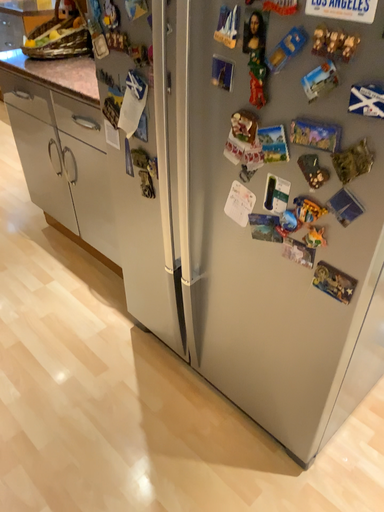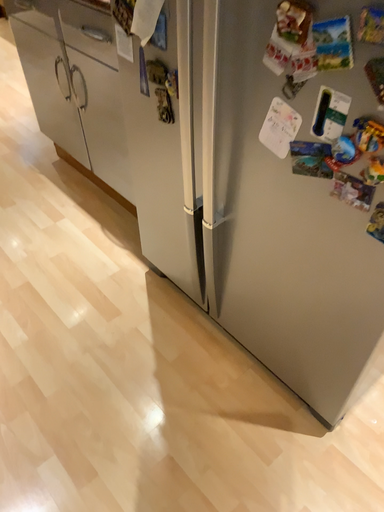
Question: How did the camera likely rotate when shooting the video?

Choices:
 (A) rotated upward
 (B) rotated downward

Answer: (B)